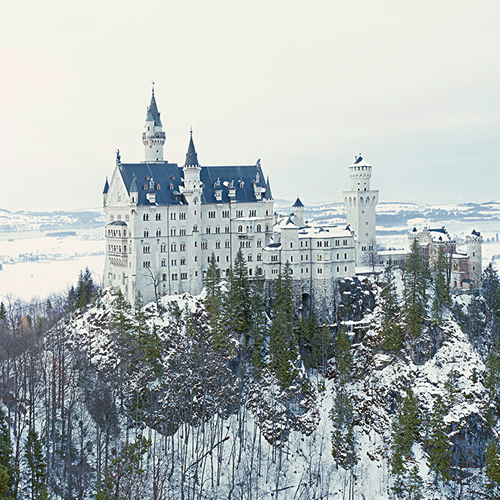
Identify the location of top left corner empty space. (5, 6).